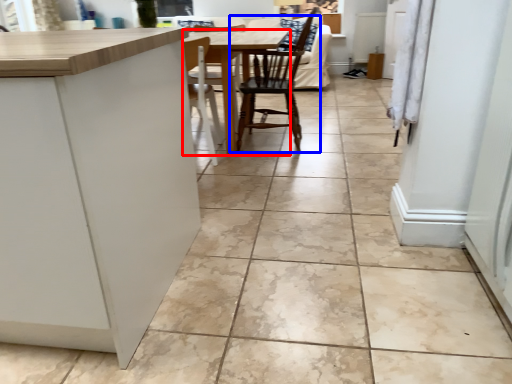
Question: Which object appears closest to the camera in this image, table (highlighted by a red box) or chair (highlighted by a blue box)?

Choices:
 (A) table
 (B) chair

Answer: (A)